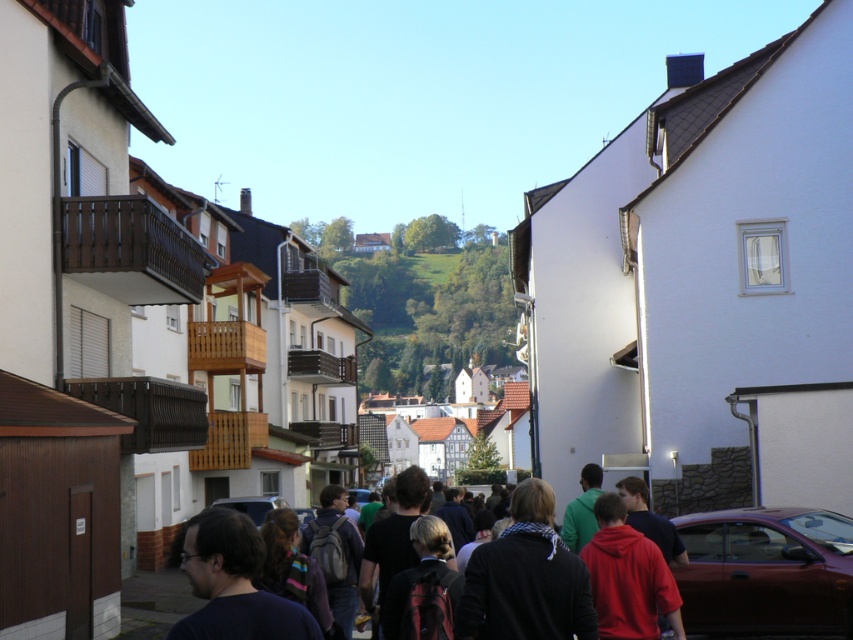
Is shiny metallic car at lower right shorter than dark clothing group at center?

Yes.

Which is behind, point (715, 536) or point (532, 524)?

The point (715, 536) is more distant.

Is point (775, 627) positioned after point (538, 532)?

Yes.

You are a GUI agent. You are given a task and a screenshot of the screen. Output one action in this format:
    pyautogui.click(x=<x>, y=<y>)
    Task: Click on the shiny metallic car at lower right
    Image resolution: width=853 pixels, height=640 pixels.
    Given the screenshot: What is the action you would take?
    pyautogui.click(x=766, y=570)